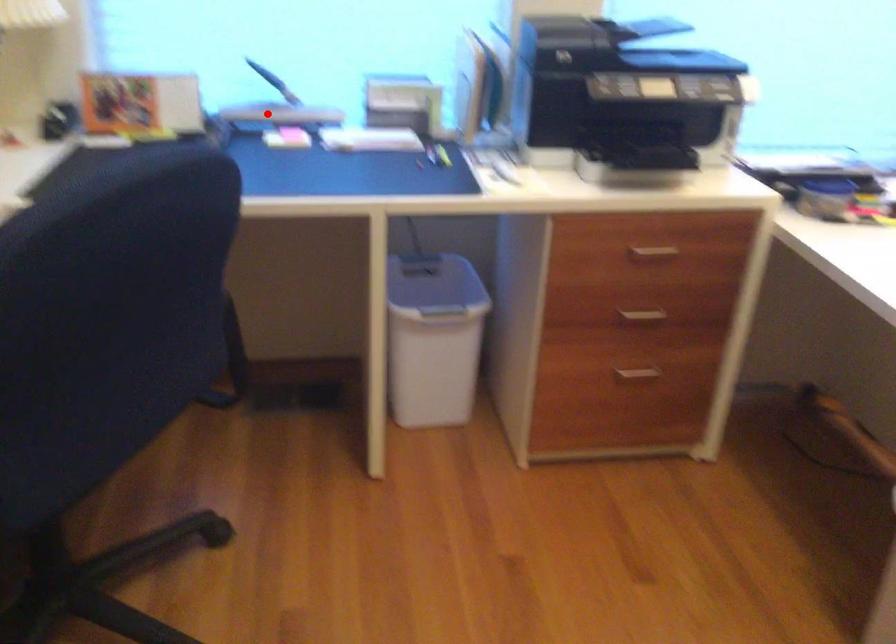
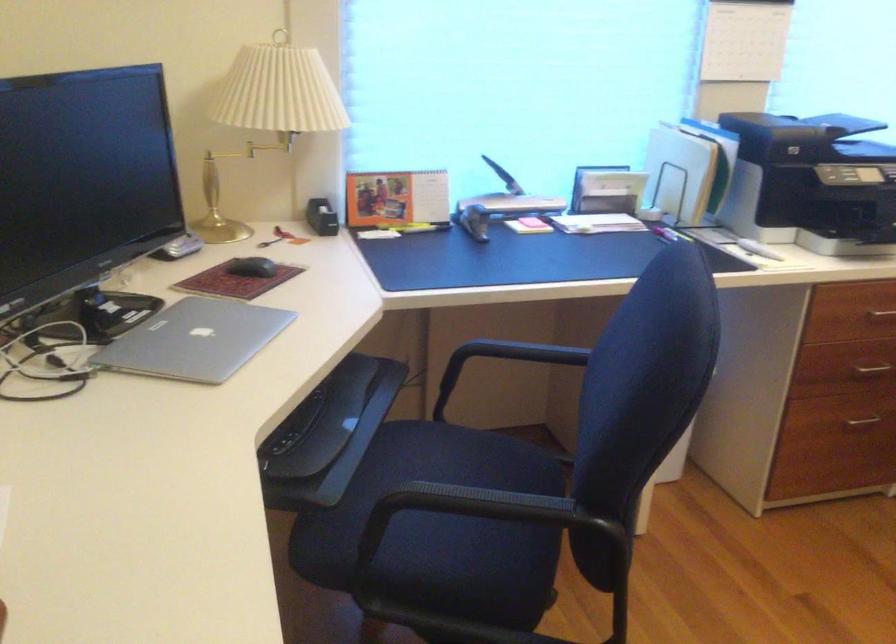
Question: I am providing you with two images of the same scene from different viewpoints. A red point is shown in image1. For the corresponding object point in image2, is it positioned nearer or farther from the camera?

Choices:
 (A) Nearer
 (B) Farther

Answer: (B)